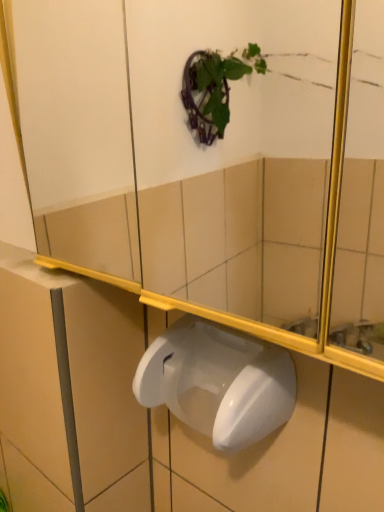
The width and height of the screenshot is (384, 512). What are the coordinates of `white glossy urinal at center` in the screenshot? It's located at click(218, 382).

What do you see at coordinates (218, 382) in the screenshot?
I see `white glossy urinal at center` at bounding box center [218, 382].

Where is `white glossy urinal at center`? Image resolution: width=384 pixels, height=512 pixels. white glossy urinal at center is located at coordinates (218, 382).